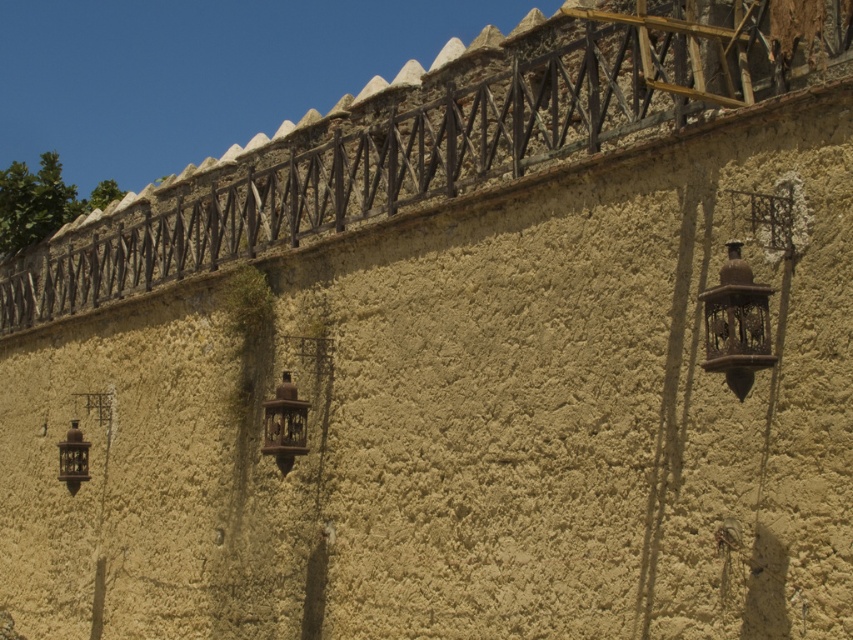
You are an architect inspecting the historical wall. You notice two lanterns, the rusty metal lantern at center and the matte bronze lantern at lower left. Which one do you think is bigger in size?

The rusty metal lantern at center is larger in size compared to the matte bronze lantern at lower left.

You are standing at the center of the wall and want to place a new lantern exactly where the antique brass lantern at right is currently located. What are the coordinates of the spot where you should place the new lantern?

The coordinates for the antique brass lantern at right are at point (735, 323), so you should place the new lantern at those coordinates.